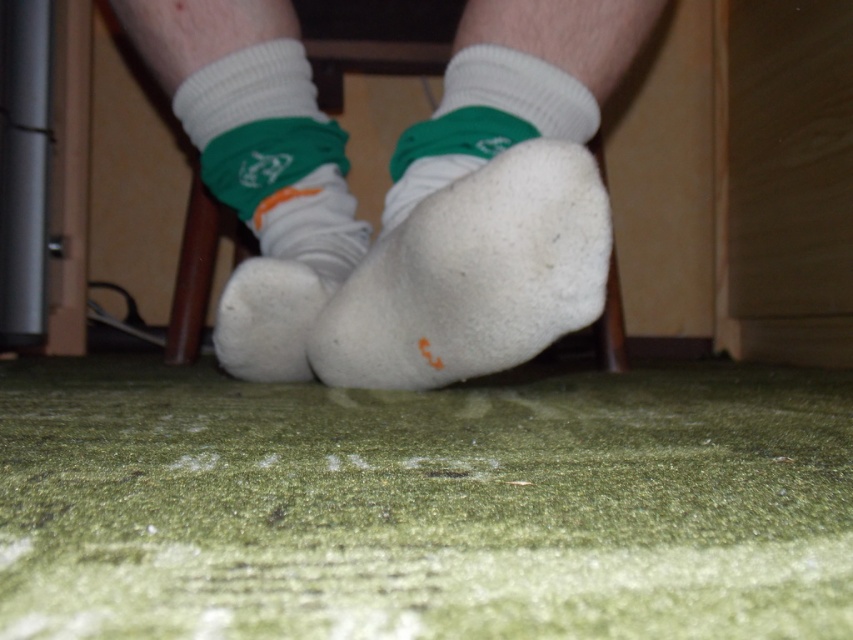
Question: Which of these objects is positioned closest to the white fuzzy sock at lower center?

Choices:
 (A) white fuzzy sock at center
 (B) white cotton socks at center

Answer: (B)

Question: Can you confirm if white cotton socks at center is positioned below white fuzzy sock at center?

Choices:
 (A) yes
 (B) no

Answer: (B)

Question: Does white cotton socks at center appear over white fuzzy sock at lower center?

Choices:
 (A) yes
 (B) no

Answer: (A)

Question: Can you confirm if white fuzzy sock at center is positioned to the right of white fuzzy sock at lower center?

Choices:
 (A) yes
 (B) no

Answer: (A)

Question: Estimate the real-world distances between objects in this image. Which object is closer to the white fuzzy sock at center?

Choices:
 (A) white fuzzy sock at lower center
 (B) white cotton socks at center

Answer: (B)

Question: Which point appears closest to the camera in this image?

Choices:
 (A) (351, 308)
 (B) (467, 35)

Answer: (A)